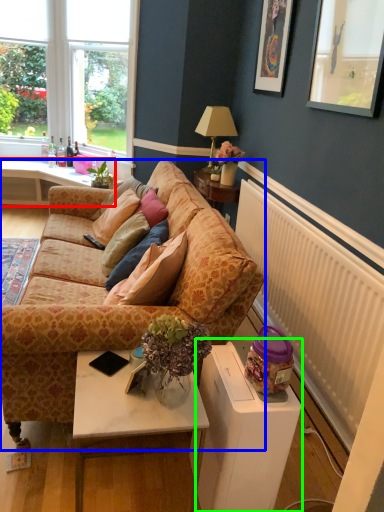
Question: Based on their relative distances, which object is nearer to desk (highlighted by a red box)? Choose from studio couch (highlighted by a blue box) and wide (highlighted by a green box).

Choices:
 (A) studio couch
 (B) wide

Answer: (A)